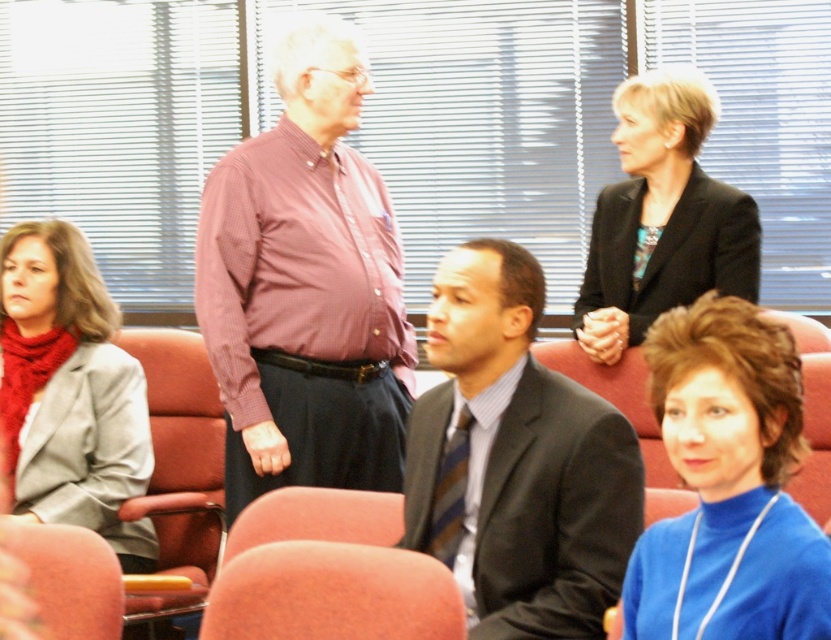
You are organizing a photo shoot and need to arrange two models based on their clothing heights. You have a matte pink shirt at center and a blue turtleneck sweater at lower right. Which clothing item should be placed higher in the frame to maintain visual balance?

The matte pink shirt at center is taller than the blue turtleneck sweater at lower right, so placing the matte pink shirt at center higher in the frame will help maintain visual balance by compensating for its greater height.

You are a photographer taking a picture of the conference room scene. You notice two points marked in the image at coordinates point (463, 348) and point (155, 413). Which of these points is closer to your camera lens?

Point (463, 348) is closer to the camera than point (155, 413).